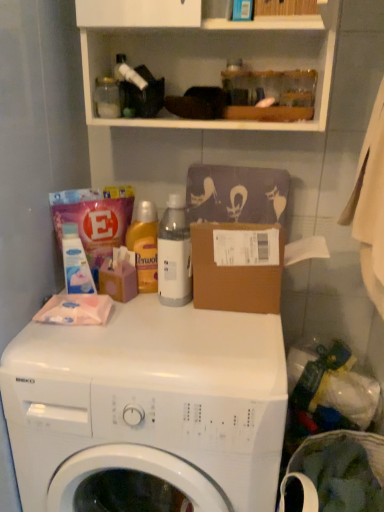
Question: Is translucent plastic bottle at center smaller than white matte detergent at left?

Choices:
 (A) yes
 (B) no

Answer: (B)

Question: Can you confirm if translucent plastic bottle at center is wider than white matte detergent at left?

Choices:
 (A) no
 (B) yes

Answer: (B)

Question: Considering the relative sizes of translucent plastic bottle at center and white matte detergent at left in the image provided, is translucent plastic bottle at center shorter than white matte detergent at left?

Choices:
 (A) no
 (B) yes

Answer: (A)

Question: Is translucent plastic bottle at center directly adjacent to white matte detergent at left?

Choices:
 (A) yes
 (B) no

Answer: (B)

Question: From the image's perspective, is translucent plastic bottle at center over white matte detergent at left?

Choices:
 (A) no
 (B) yes

Answer: (B)

Question: Is translucent plastic bottle at center outside white matte detergent at left?

Choices:
 (A) yes
 (B) no

Answer: (A)

Question: Can you confirm if white matte cabinet at upper center is thinner than white matte detergent at left?

Choices:
 (A) yes
 (B) no

Answer: (B)

Question: Is white matte detergent at left a part of white matte cabinet at upper center?

Choices:
 (A) no
 (B) yes

Answer: (A)

Question: Is white matte cabinet at upper center further to the viewer compared to white matte detergent at left?

Choices:
 (A) no
 (B) yes

Answer: (A)

Question: Is white matte cabinet at upper center placed right next to white matte detergent at left?

Choices:
 (A) yes
 (B) no

Answer: (B)

Question: From the image's perspective, is white matte cabinet at upper center on top of white matte detergent at left?

Choices:
 (A) no
 (B) yes

Answer: (B)

Question: From a real-world perspective, is white matte cabinet at upper center below white matte detergent at left?

Choices:
 (A) no
 (B) yes

Answer: (A)

Question: Is clear plastic laundry basket at lower right surrounded by white matte detergent at left?

Choices:
 (A) yes
 (B) no

Answer: (B)